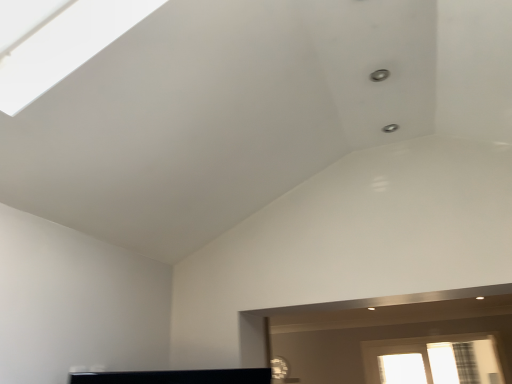
You are a GUI agent. You are given a task and a screenshot of the screen. Output one action in this format:
    pyautogui.click(x=<x>, y=<y>)
    Task: Click on the translucent glass window at lower right
    
    Given the screenshot: What is the action you would take?
    pyautogui.click(x=436, y=359)

Describe the element at coordinates (436, 359) in the screenshot. The image size is (512, 384). I see `translucent glass window at lower right` at that location.

At what (x,y) coordinates should I click in order to perform the action: click on translucent glass window at lower right. Please return your answer as a coordinate pair (x, y). This screenshot has width=512, height=384. Looking at the image, I should click on (436, 359).